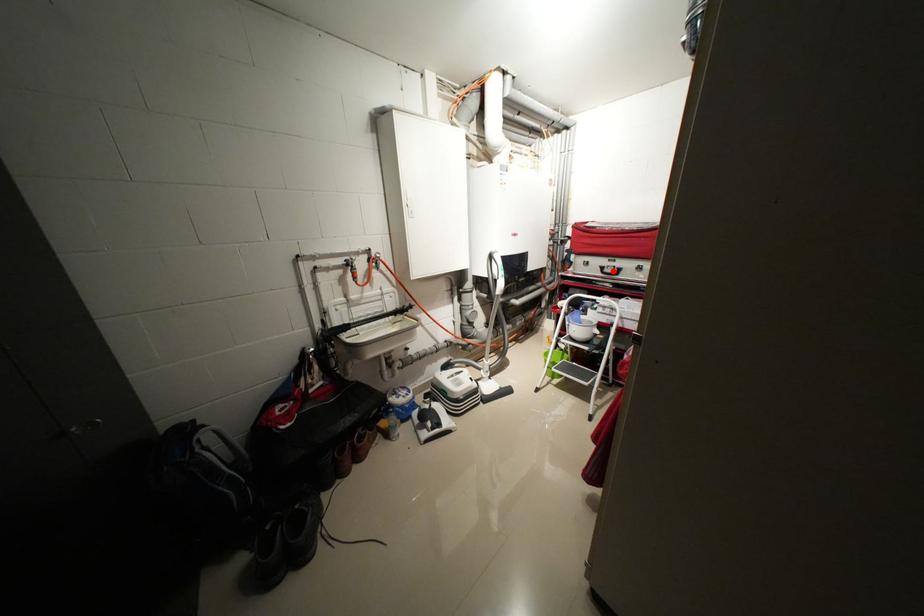
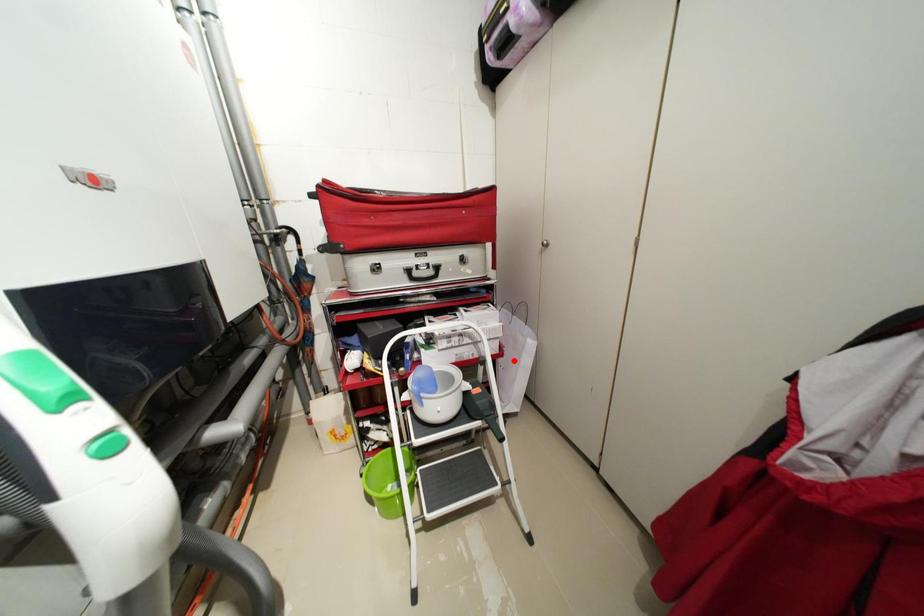
I am providing you with two images of the same scene from different viewpoints. A red point is marked on the first image and another point is marked on the second image. Are the points marked in image1 and image2 representing the same 3D position?

No